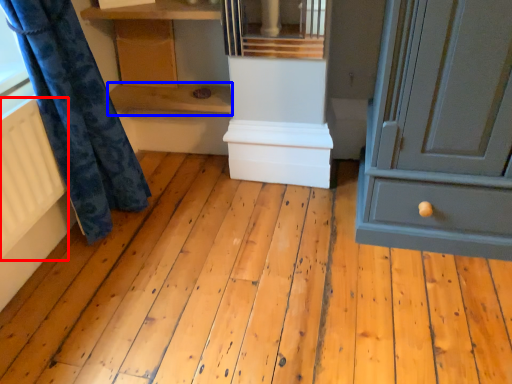
Question: Among these objects, which one is farthest to the camera, radiator (highlighted by a red box) or shelf (highlighted by a blue box)?

Choices:
 (A) radiator
 (B) shelf

Answer: (B)